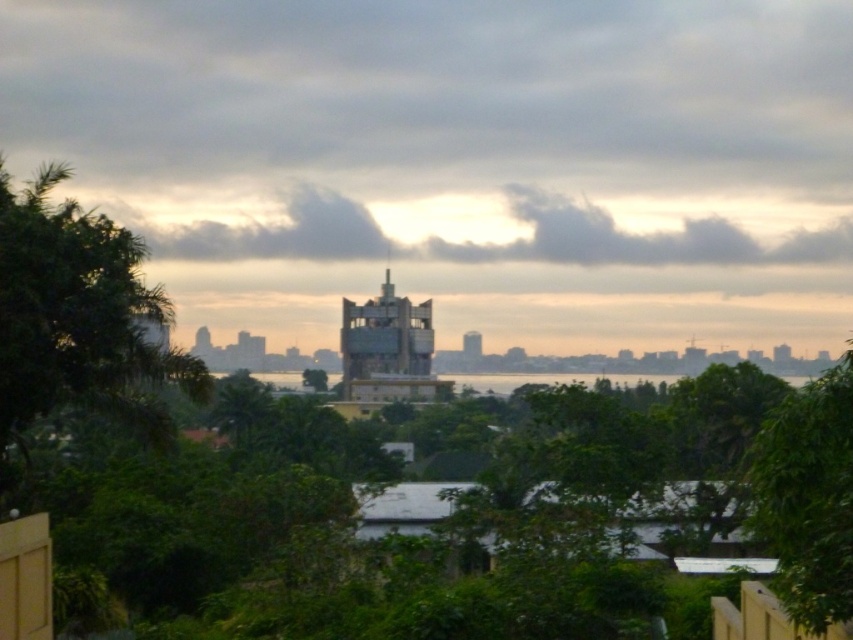
You are standing at the center of the city park and want to locate the metallic glass tower at center. According to the coordinates provided, in which direction should you look to find it?

The metallic glass tower at center is located at coordinates point (387, 349), so you should look towards the center of the image to find it.

You are standing in front of the cityscape image and want to determine which of the two points, point (x=100, y=291) or point (x=190, y=227), is nearer to you. Based on the scene description, which point is closer?

Point (x=100, y=291) is closer to the camera than point (x=190, y=227), so it is the nearer one.

You are a drone operator tasked with flying a drone between the metallic glass tower at center and the green leafy tree at center. The drone has a maximum flight distance of 40 feet. Can the drone safely make the trip between these two landmarks without exceeding its range?

The distance between the metallic glass tower at center and the green leafy tree at center is 38.26 feet, which is within the drone operator s 40 feet maximum flight range. Therefore, the drone can safely travel between them without exceeding its range.